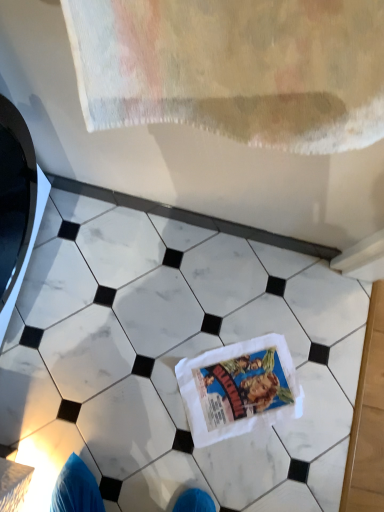
You are a GUI agent. You are given a task and a screenshot of the screen. Output one action in this format:
    pyautogui.click(x=<x>, y=<y>)
    Task: Click on the free point above white marble tile at center (from a real-world perspective)
    
    Given the screenshot: What is the action you would take?
    pyautogui.click(x=193, y=369)